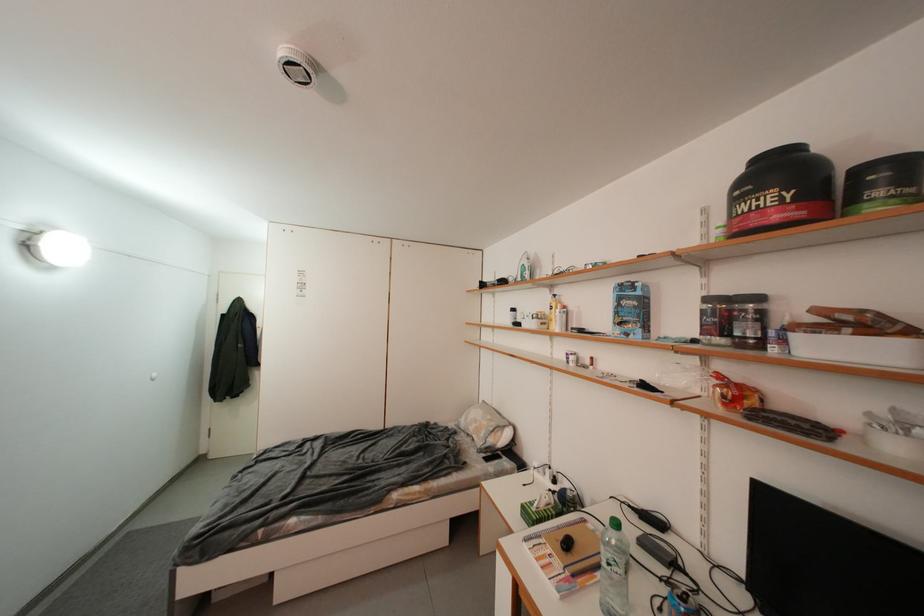
Where is `black whey container`? The width and height of the screenshot is (924, 616). black whey container is located at coordinates (882, 184).